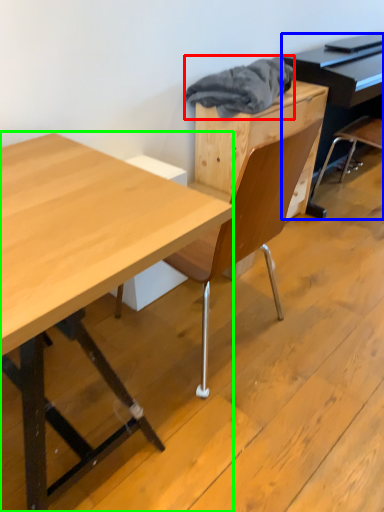
Question: Estimate the real-world distances between objects in this image. Which object is farther from material (highlighted by a red box), piano (highlighted by a blue box) or desk (highlighted by a green box)?

Choices:
 (A) piano
 (B) desk

Answer: (B)